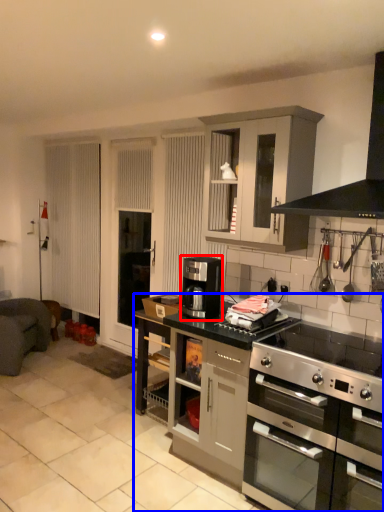
Question: Which object is closer to the camera taking this photo, coffee machine (highlighted by a red box) or counter (highlighted by a blue box)?

Choices:
 (A) coffee machine
 (B) counter

Answer: (B)